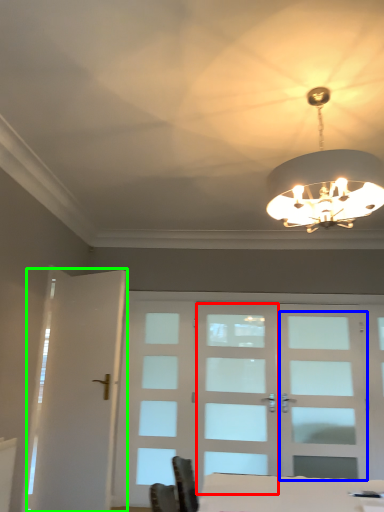
Question: Which is farther away from screen door (highlighted by a red box)? screen door (highlighted by a blue box) or screen door (highlighted by a green box)?

Choices:
 (A) screen door
 (B) screen door

Answer: (B)